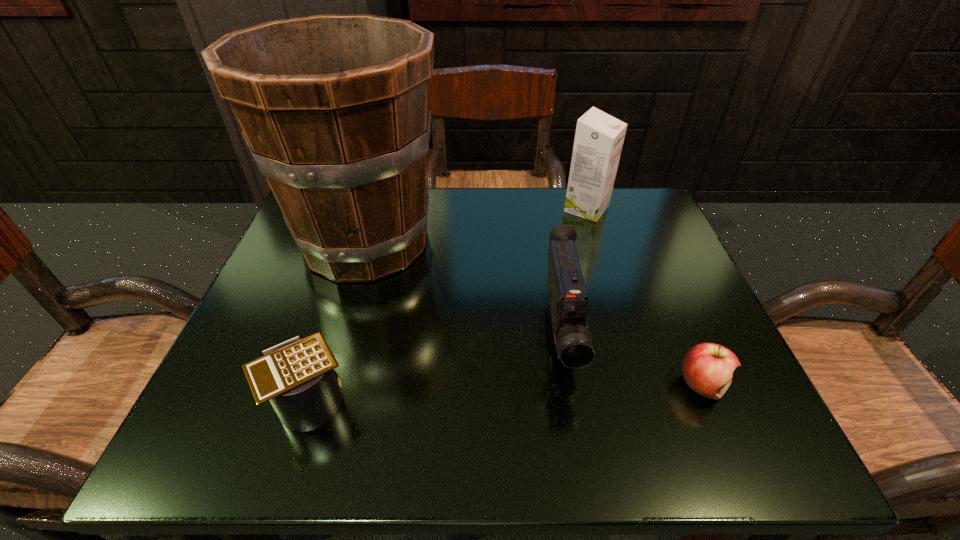
This screenshot has width=960, height=540. In order to click on bucket in this screenshot , I will do `click(335, 109)`.

Where is `the fourth shortest object`? Image resolution: width=960 pixels, height=540 pixels. the fourth shortest object is located at coordinates (599, 137).

This screenshot has width=960, height=540. What are the coordinates of `carton` in the screenshot? It's located at (599, 137).

Image resolution: width=960 pixels, height=540 pixels. What are the coordinates of `the third object from right to left` in the screenshot? It's located at (567, 295).

Identify the location of camcorder. (567, 295).

Identify the location of the fourth tallest object. (297, 376).

I want to click on apple, so click(x=707, y=368).

At what (x,y) coordinates should I click in order to perform the action: click on the shortest object. Please return your answer as a coordinate pair (x, y). Looking at the image, I should click on (707, 368).

Locate an element on the screen. The height and width of the screenshot is (540, 960). free point located 0.280m on the right of the bucket is located at coordinates (565, 241).

I want to click on free space located 0.120m on the front of the fourth object from left to right, so click(x=600, y=254).